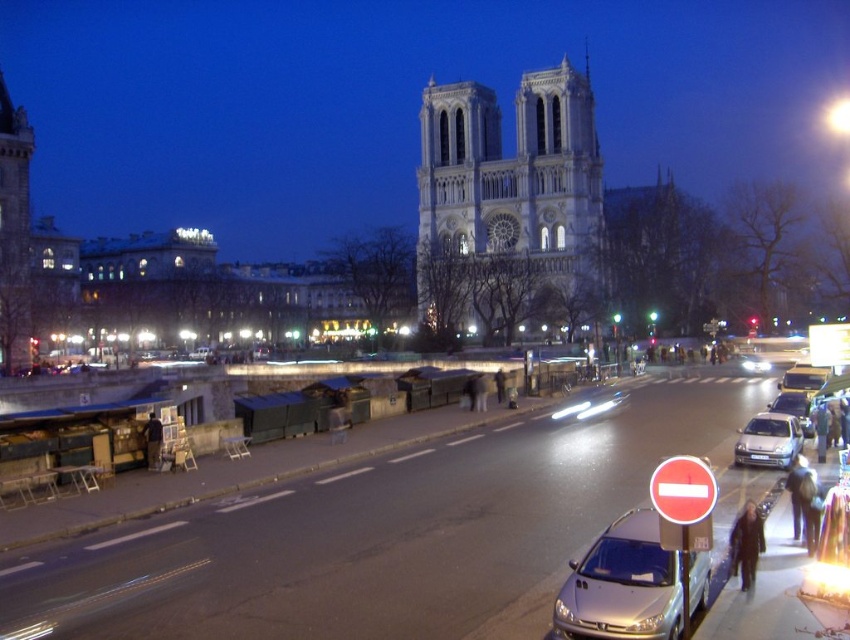
Question: Is metallic silver car at lower center further to the viewer compared to metallic silver sedan at center?

Choices:
 (A) yes
 (B) no

Answer: (B)

Question: Considering the relative positions of satin silver car at lower right and metallic silver sedan at center in the image provided, where is satin silver car at lower right located with respect to metallic silver sedan at center?

Choices:
 (A) above
 (B) below

Answer: (B)

Question: Can you confirm if metallic silver car at lower center is positioned above satin silver car at lower right?

Choices:
 (A) no
 (B) yes

Answer: (A)

Question: Which point is farther to the camera?

Choices:
 (A) metallic silver car at lower center
 (B) metallic silver sedan at center
 (C) white stone cathedral at center

Answer: (C)

Question: Estimate the real-world distances between objects in this image. Which object is farther from the metallic silver car at lower center?

Choices:
 (A) white stone cathedral at center
 (B) metallic silver sedan at center

Answer: (A)

Question: Which point is closer to the camera?

Choices:
 (A) metallic silver car at lower center
 (B) white stone cathedral at center

Answer: (A)